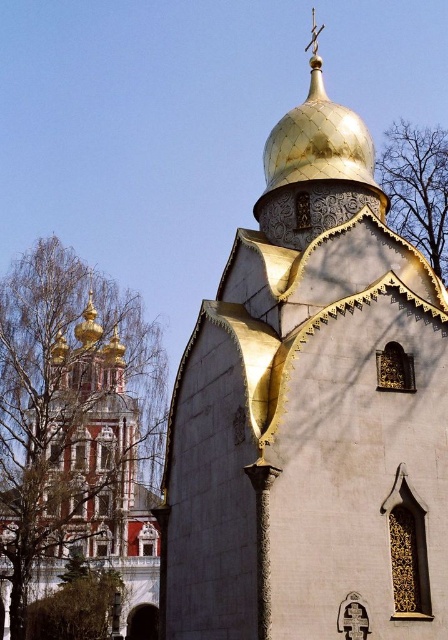
Question: Does gold textured dome at center appear on the right side of gold/gilded dome at upper left?

Choices:
 (A) no
 (B) yes

Answer: (B)

Question: Can you confirm if gold textured dome at center is thinner than gold/gilded dome at upper left?

Choices:
 (A) yes
 (B) no

Answer: (B)

Question: Is gold textured dome at center thinner than gold/gilded dome at upper left?

Choices:
 (A) no
 (B) yes

Answer: (A)